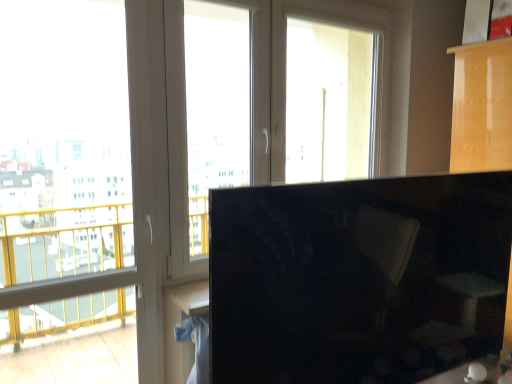
Question: Does point (222, 87) appear closer or farther from the camera than point (240, 205)?

Choices:
 (A) closer
 (B) farther

Answer: (B)

Question: Is transparent glass window at center, acting as the second window screen starting from the left, taller or shorter than black glossy monitor at right?

Choices:
 (A) short
 (B) tall

Answer: (B)

Question: Which is farther from the black glossy monitor at right?

Choices:
 (A) transparent glass window at center, the second window screen when ordered from right to left
 (B) transparent glass window at left, the third window screen viewed from the right
 (C) transparent glass window at upper center, the third window screen positioned from the left

Answer: (C)

Question: Estimate the real-world distances between objects in this image. Which object is farther from the transparent glass window at upper center, the first window screen in the right-to-left sequence?

Choices:
 (A) transparent glass window at center, acting as the second window screen starting from the left
 (B) transparent glass window at left, the third window screen viewed from the right
 (C) black glossy monitor at right

Answer: (B)